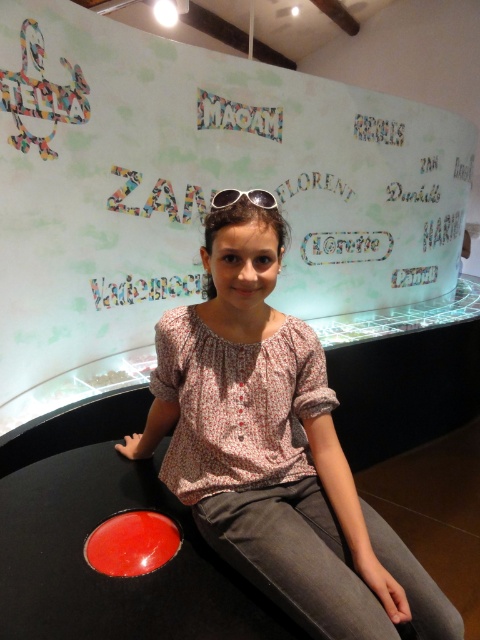
Locate an element on the screen. The width and height of the screenshot is (480, 640). metallic glass display case at center is located at coordinates (193, 193).

Locate an element on the screen. This screenshot has width=480, height=640. metallic glass display case at center is located at coordinates (193, 193).

Which is above, metallic glass display case at center or pink floral blouse at center?

metallic glass display case at center

Who is more forward, [409,125] or [197,420]?

Positioned in front is point [197,420].

Is point (127, 36) behind point (282, 497)?

Yes, point (127, 36) is farther from viewer.

At what (x,y) coordinates should I click in order to perform the action: click on metallic glass display case at center. Please return your answer as a coordinate pair (x, y). Looking at the image, I should click on (193, 193).

Which of these two, pink floral blouse at center or silver reflective sunglasses at center, stands shorter?

With less height is silver reflective sunglasses at center.

Between point (269, 557) and point (225, 200), which one is positioned behind?

Point (225, 200)

Which is behind, point (376, 564) or point (259, 205)?

Positioned behind is point (259, 205).

At what (x,y) coordinates should I click in order to perform the action: click on pink floral blouse at center. Please return your answer as a coordinate pair (x, y). The height and width of the screenshot is (640, 480). Looking at the image, I should click on (275, 451).